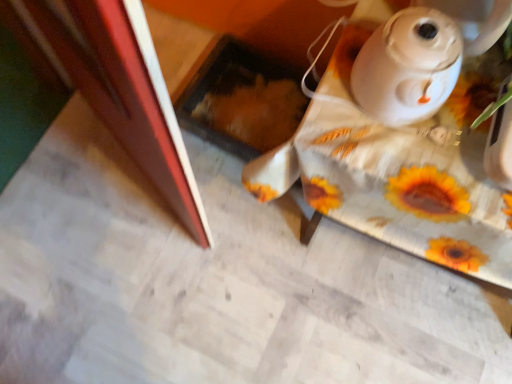
Locate an element on the screen. Image resolution: width=512 pixels, height=384 pixels. vacant space to the left of white glossy kettle at upper right is located at coordinates (331, 104).